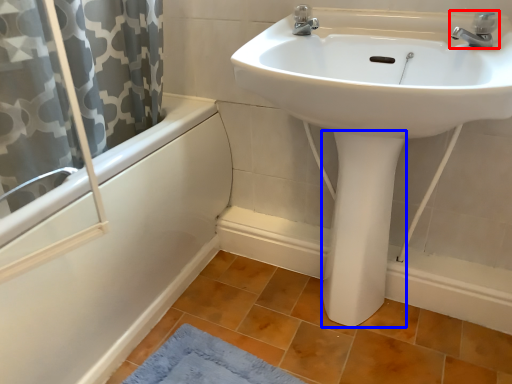
Question: Which point is further to the camera, tap (highlighted by a red box) or bidet (highlighted by a blue box)?

Choices:
 (A) tap
 (B) bidet

Answer: (B)